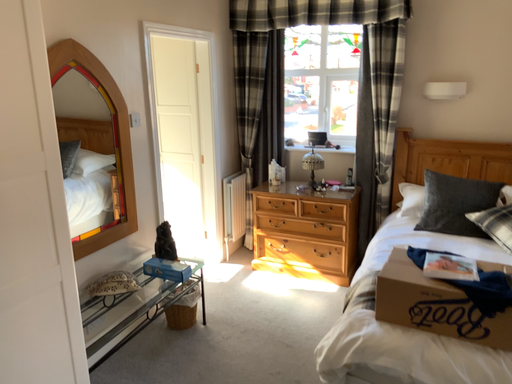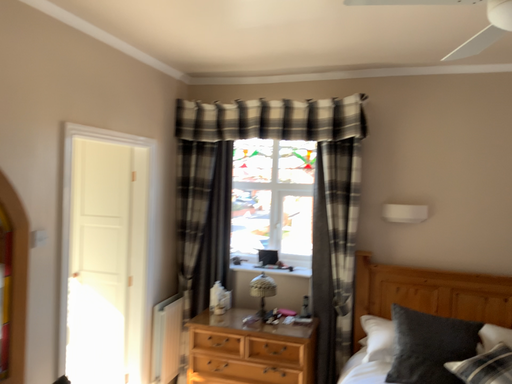
Question: How did the camera likely rotate when shooting the video?

Choices:
 (A) rotated right
 (B) rotated left

Answer: (A)